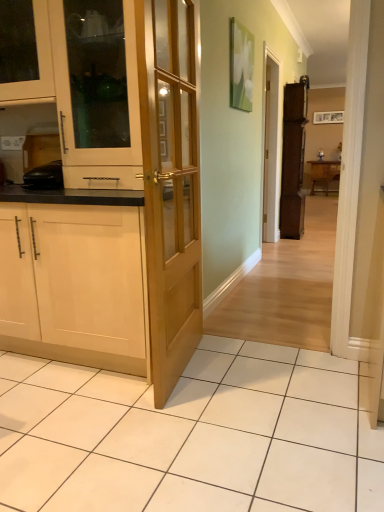
Question: In terms of width, does brown wooden cabinet at right, which ranks as the 4th cabinetry in front-to-back order, look wider or thinner when compared to white wood cabinet at left, the 2th cabinetry in the front-to-back sequence?

Choices:
 (A) wide
 (B) thin

Answer: (B)

Question: From a real-world perspective, is brown wooden cabinet at right, which is the first cabinetry in right-to-left order, positioned above or below white wood cabinet at left, the 2th cabinetry in the front-to-back sequence?

Choices:
 (A) below
 (B) above

Answer: (A)

Question: Estimate the real-world distances between objects in this image. Which object is closer to the matte wood cabinet at upper left, which is the fourth cabinetry in right-to-left order?

Choices:
 (A) white wood cabinet at left, placed as the third cabinetry when sorted from left to right
 (B) wooden table at right
 (C) light wood door at center
 (D) brown wooden cabinet at right, marked as the first cabinetry in a back-to-front arrangement
 (E) light wood cabinet at left, the fourth cabinetry from the back

Answer: (A)

Question: Which of these objects is positioned closest to the matte wood cabinet at upper left, which ranks as the third cabinetry in front-to-back order?

Choices:
 (A) wooden table at right
 (B) light wood door at center
 (C) white wood cabinet at left, positioned as the 2th cabinetry in right-to-left order
 (D) light wood cabinet at left, positioned as the third cabinetry in right-to-left order
 (E) brown wooden cabinet at right, the fourth cabinetry from the left

Answer: (C)